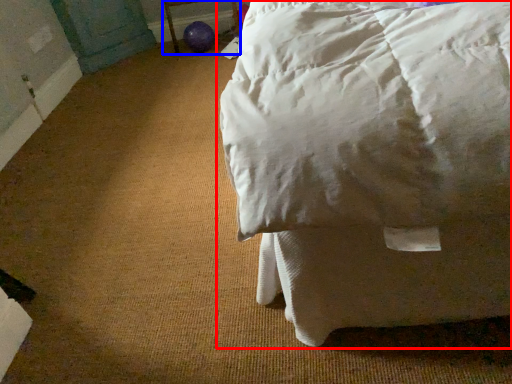
Question: Which point is closer to the camera, bed (highlighted by a red box) or furniture (highlighted by a blue box)?

Choices:
 (A) bed
 (B) furniture

Answer: (A)